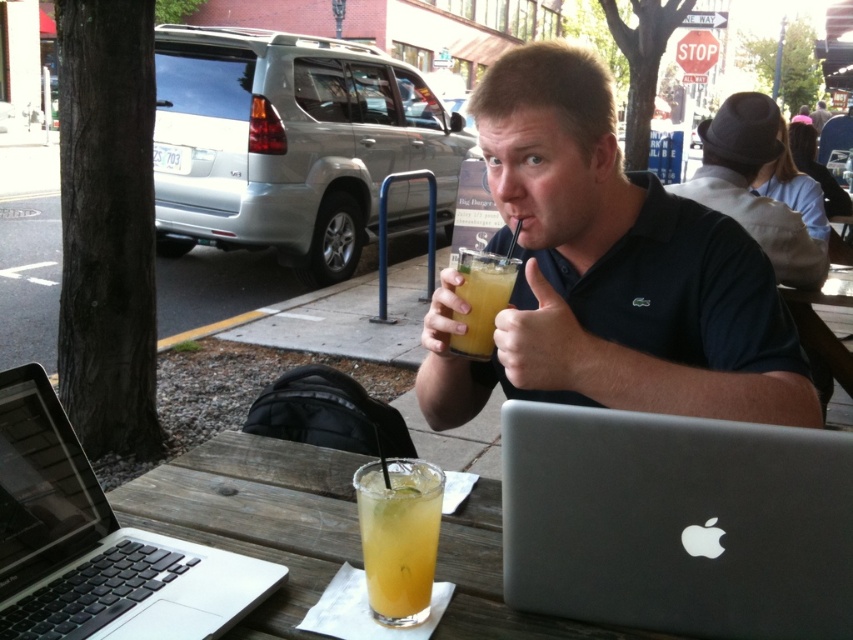
Which is in front, point (805, 243) or point (386, 513)?

Positioned in front is point (386, 513).

Based on the photo, is gray felt hat at upper right bigger than translucent glass at center?

Yes.

Identify the location of gray felt hat at upper right. Image resolution: width=853 pixels, height=640 pixels. (751, 188).

Does gray felt hat at upper right have a lesser height compared to yellow translucent glass at center?

No.

Is gray felt hat at upper right bigger than yellow translucent glass at center?

Yes.

Is point (798, 228) closer to viewer compared to point (465, 256)?

No, (798, 228) is further to viewer.

In order to click on gray felt hat at upper right in this screenshot , I will do `click(751, 188)`.

Who is taller, wooden table at center or yellow translucent glass at center?

With more height is yellow translucent glass at center.

Does wooden table at center have a lesser width compared to yellow translucent glass at center?

No, wooden table at center is not thinner than yellow translucent glass at center.

Describe the element at coordinates (257, 515) in the screenshot. Image resolution: width=853 pixels, height=640 pixels. I see `wooden table at center` at that location.

I want to click on wooden table at center, so click(x=257, y=515).